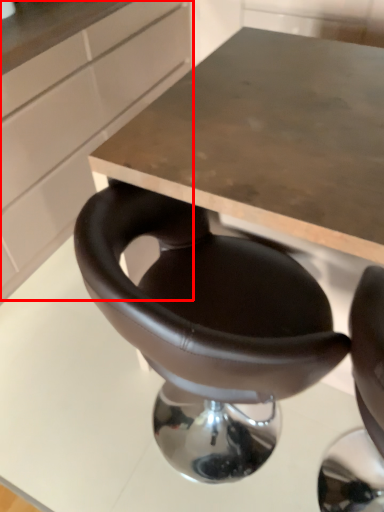
Question: Considering the relative positions of cabinetry (annotated by the red box) and chair in the image provided, where is cabinetry (annotated by the red box) located with respect to the staircase?

Choices:
 (A) left
 (B) right

Answer: (A)